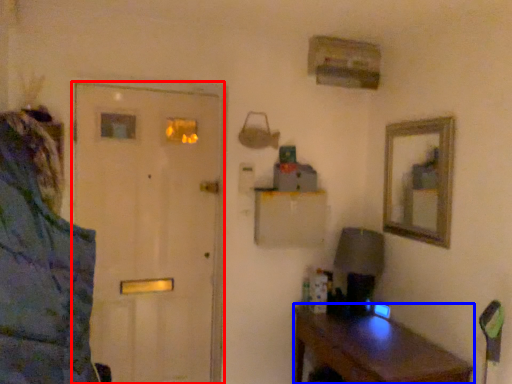
Question: Which object appears farthest to the camera in this image, door (highlighted by a red box) or desk (highlighted by a blue box)?

Choices:
 (A) door
 (B) desk

Answer: (A)